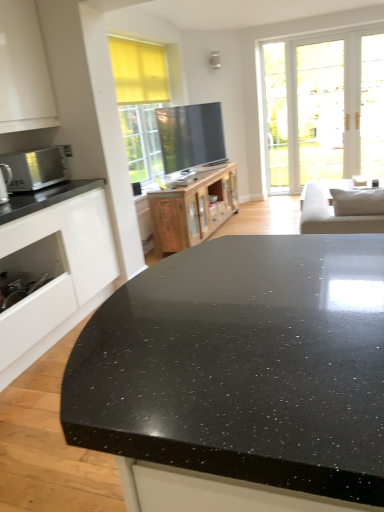
What is the approximate width of wooden cabinet at center, acting as the second cabinetry starting from the left?

wooden cabinet at center, acting as the second cabinetry starting from the left, is 17.05 inches in width.

At what (x,y) coordinates should I click in order to perform the action: click on black speckled granite countertop at center. Please return your answer as a coordinate pair (x, y). Looking at the image, I should click on (240, 377).

In order to click on cabinetry lying behind the white glossy cabinet at left, positioned as the 1th cabinetry in front-to-back order in this screenshot , I will do `click(193, 209)`.

Does point (53, 305) appear closer or farther from the camera than point (172, 195)?

Point (53, 305) is positioned closer to the camera compared to point (172, 195).

From the picture: From a real-world perspective, which is physically above, white glossy cabinet at left, marked as the 2th cabinetry in a back-to-front arrangement, or wooden cabinet at center, acting as the second cabinetry starting from the left?

white glossy cabinet at left, marked as the 2th cabinetry in a back-to-front arrangement, from a real-world perspective.

From a real-world perspective, does satin silver microwave at left stand above white glossy cabinet at left, positioned as the 1th cabinetry in front-to-back order?

Yes, from a real-world perspective, satin silver microwave at left is above white glossy cabinet at left, positioned as the 1th cabinetry in front-to-back order.

Which is in front, satin silver microwave at left or white glossy cabinet at left, arranged as the second cabinetry when viewed from the right?

white glossy cabinet at left, arranged as the second cabinetry when viewed from the right, is closer to the camera.

In the scene shown: Is satin silver microwave at left not within white glossy cabinet at left, the 1th cabinetry viewed from the left?

Yes.

Can you tell me how much satin silver microwave at left and white glossy cabinet at left, positioned as the 1th cabinetry in front-to-back order, differ in facing direction?

The facing directions of satin silver microwave at left and white glossy cabinet at left, positioned as the 1th cabinetry in front-to-back order, are 1.92 degrees apart.

Considering the sizes of matte silver microwave at left and black speckled granite countertop at center in the image, is matte silver microwave at left wider or thinner than black speckled granite countertop at center?

matte silver microwave at left is thinner than black speckled granite countertop at center.

What's the angular difference between matte silver microwave at left and black speckled granite countertop at center's facing directions?

The angular difference between matte silver microwave at left and black speckled granite countertop at center is 40.9 degrees.

Measure the distance between matte silver microwave at left and black speckled granite countertop at center.

matte silver microwave at left and black speckled granite countertop at center are 7.23 feet apart.

The width and height of the screenshot is (384, 512). Find the location of `appliance on the left of black speckled granite countertop at center`. appliance on the left of black speckled granite countertop at center is located at coordinates (5, 182).

Considering the sizes of objects matte silver microwave at left and white glossy cabinet at left, the 1th cabinetry viewed from the left, in the image provided, who is taller, matte silver microwave at left or white glossy cabinet at left, the 1th cabinetry viewed from the left,?

Standing taller between the two is white glossy cabinet at left, the 1th cabinetry viewed from the left.

Where is `cabinetry in front of the matte silver microwave at left`? The image size is (384, 512). cabinetry in front of the matte silver microwave at left is located at coordinates (x=58, y=277).

Is matte silver microwave at left not within white glossy cabinet at left, arranged as the second cabinetry when viewed from the right?

matte silver microwave at left lies outside white glossy cabinet at left, arranged as the second cabinetry when viewed from the right,'s area.

Is the position of matte silver microwave at left less distant than that of white glossy cabinet at left, arranged as the second cabinetry when viewed from the right?

No, it is behind white glossy cabinet at left, arranged as the second cabinetry when viewed from the right.

Which of these two, black speckled granite countertop at center or wooden cabinet at center, the second cabinetry viewed from the front, is thinner?

Thinner between the two is black speckled granite countertop at center.

Considering the relative sizes of black speckled granite countertop at center and wooden cabinet at center, placed as the 1th cabinetry when sorted from right to left, in the image provided, is black speckled granite countertop at center smaller than wooden cabinet at center, placed as the 1th cabinetry when sorted from right to left,?

Indeed, black speckled granite countertop at center has a smaller size compared to wooden cabinet at center, placed as the 1th cabinetry when sorted from right to left.

Which point is more forward, (340, 446) or (213, 205)?

The point (340, 446) is in front.

Is black speckled granite countertop at center at the right side of wooden cabinet at center, the second cabinetry viewed from the front?

No, black speckled granite countertop at center is not to the right of wooden cabinet at center, the second cabinetry viewed from the front.

Could you tell me if satin silver microwave at left is facing matte silver microwave at left?

No.

Measure the distance from satin silver microwave at left to matte silver microwave at left.

The distance of satin silver microwave at left from matte silver microwave at left is 10.06 inches.

Would you say satin silver microwave at left is to the left or to the right of matte silver microwave at left in the picture?

Clearly, satin silver microwave at left is on the right of matte silver microwave at left in the image.

Can you confirm if white glossy cabinet at left, the 1th cabinetry viewed from the left, is thinner than black speckled granite countertop at center?

In fact, white glossy cabinet at left, the 1th cabinetry viewed from the left, might be wider than black speckled granite countertop at center.

Measure the distance from white glossy cabinet at left, positioned as the 1th cabinetry in front-to-back order, to black speckled granite countertop at center.

They are 1.79 meters apart.

From the image's perspective, which object appears higher, white glossy cabinet at left, positioned as the 1th cabinetry in front-to-back order, or black speckled granite countertop at center?

white glossy cabinet at left, positioned as the 1th cabinetry in front-to-back order, is shown above in the image.

I want to click on cabinetry above the black speckled granite countertop at center (from a real-world perspective), so click(x=58, y=277).

I want to click on cabinetry below the white glossy cabinet at left, positioned as the 1th cabinetry in front-to-back order (from a real-world perspective), so click(193, 209).

The width and height of the screenshot is (384, 512). Identify the location of the 2nd cabinetry below the satin silver microwave at left (from the image's perspective). (58, 277).

Based on their spatial positions, is white glossy cabinet at left, the 1th cabinetry viewed from the left, or matte silver microwave at left further from satin silver microwave at left?

The object further to satin silver microwave at left is white glossy cabinet at left, the 1th cabinetry viewed from the left.

Looking at the image, which one is located further to white glossy cabinet at left, arranged as the second cabinetry when viewed from the right, satin silver microwave at left or black speckled granite countertop at center?

black speckled granite countertop at center is positioned further to the anchor white glossy cabinet at left, arranged as the second cabinetry when viewed from the right.

Based on their spatial positions, is black speckled granite countertop at center or white glossy cabinet at left, the 1th cabinetry viewed from the left, closer to matte silver microwave at left?

white glossy cabinet at left, the 1th cabinetry viewed from the left, lies closer to matte silver microwave at left than the other object.

Looking at the image, which one is located closer to wooden cabinet at center, placed as the 1th cabinetry when sorted from right to left, matte silver microwave at left or black speckled granite countertop at center?

Based on the image, matte silver microwave at left appears to be nearer to wooden cabinet at center, placed as the 1th cabinetry when sorted from right to left.

Looking at the image, which one is located further to black speckled granite countertop at center, satin silver microwave at left or wooden cabinet at center, acting as the second cabinetry starting from the left?

The object further to black speckled granite countertop at center is wooden cabinet at center, acting as the second cabinetry starting from the left.

Looking at the image, which one is located closer to white glossy cabinet at left, positioned as the 1th cabinetry in front-to-back order, matte silver microwave at left or black speckled granite countertop at center?

Among the two, matte silver microwave at left is located nearer to white glossy cabinet at left, positioned as the 1th cabinetry in front-to-back order.

Estimate the real-world distances between objects in this image. Which object is closer to matte silver microwave at left, black speckled granite countertop at center or wooden cabinet at center, acting as the second cabinetry starting from the left?

wooden cabinet at center, acting as the second cabinetry starting from the left.

Considering their positions, is matte silver microwave at left positioned closer to satin silver microwave at left than white glossy cabinet at left, marked as the 2th cabinetry in a back-to-front arrangement?

Based on the image, matte silver microwave at left appears to be nearer to satin silver microwave at left.

Locate an element on the screen. The width and height of the screenshot is (384, 512). microwave oven located between matte silver microwave at left and wooden cabinet at center, acting as the second cabinetry starting from the left, in the left-right direction is located at coordinates (35, 168).

The height and width of the screenshot is (512, 384). In order to click on microwave oven located between white glossy cabinet at left, the 1th cabinetry viewed from the left, and wooden cabinet at center, the second cabinetry viewed from the front, in the depth direction in this screenshot , I will do `click(35, 168)`.

Identify the location of appliance located between black speckled granite countertop at center and wooden cabinet at center, placed as the 1th cabinetry when sorted from right to left, in the depth direction. The image size is (384, 512). (5, 182).

The width and height of the screenshot is (384, 512). Identify the location of appliance between white glossy cabinet at left, positioned as the 1th cabinetry in front-to-back order, and wooden cabinet at center, which ranks as the 1th cabinetry in back-to-front order, from front to back. (5, 182).